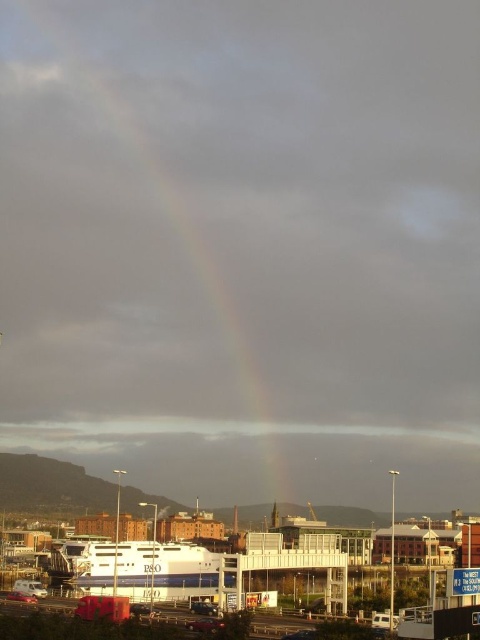
You are a photographer standing on the pier. You want to take a photo of the white glossy ferry at center without the rainbow at center obstructing it. Is this possible given their positions?

The rainbow at center is positioned over the white glossy ferry at center, so taking a photo without the rainbow obstructing the ferry would require adjusting the angle or waiting for the rainbow to disappear.